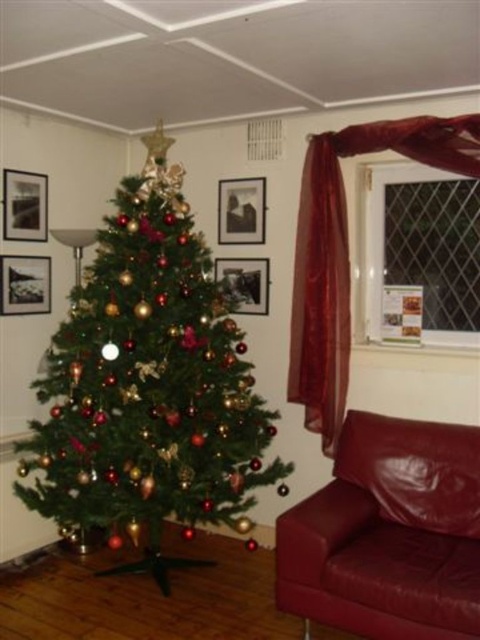
Does point (35, 195) come closer to viewer compared to point (34, 307)?

Yes, it is in front of point (34, 307).

Does black matte picture frame at upper left lie behind black matte picture frame at left?

That is False.

Does point (2, 236) come farther from viewer compared to point (19, 266)?

No, it is in front of (19, 266).

You are a GUI agent. You are given a task and a screenshot of the screen. Output one action in this format:
    pyautogui.click(x=<x>, y=<y>)
    Task: Click on the black matte picture frame at upper left
    The image size is (480, 640).
    Given the screenshot: What is the action you would take?
    pyautogui.click(x=24, y=205)

Is point (251, 220) positioned after point (19, 266)?

Yes, it is.

Is black matte picture frame at upper center smaller than black matte picture frame at left?

Indeed, black matte picture frame at upper center has a smaller size compared to black matte picture frame at left.

Locate an element on the screen. Image resolution: width=480 pixels, height=640 pixels. black matte picture frame at upper center is located at coordinates (241, 211).

The image size is (480, 640). What are the coordinates of `black matte picture frame at upper center` in the screenshot? It's located at (241, 211).

Between satin red curtain at right and black matte picture frame at upper center, which one appears on the right side from the viewer's perspective?

From the viewer's perspective, satin red curtain at right appears more on the right side.

Is point (474, 132) farther from camera compared to point (241, 232)?

No.

At what (x,y) coordinates should I click in order to perform the action: click on satin red curtain at right. Please return your answer as a coordinate pair (x, y). The height and width of the screenshot is (640, 480). Looking at the image, I should click on (348, 252).